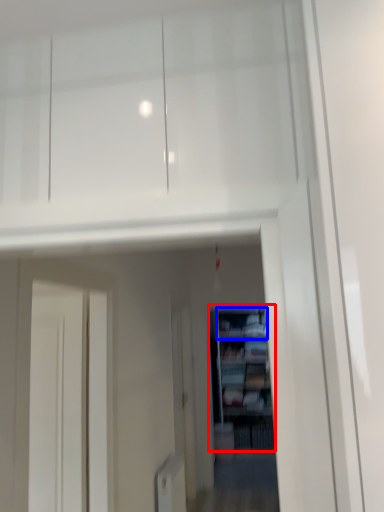
Question: Among these objects, which one is farthest to the camera, shelf (highlighted by a red box) or cabinet (highlighted by a blue box)?

Choices:
 (A) shelf
 (B) cabinet

Answer: (B)